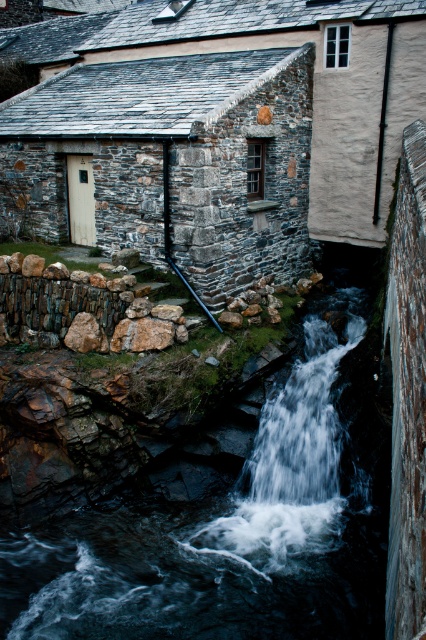
Is rocky stone waterfall at center wider than translucent white water at center?

Incorrect, rocky stone waterfall at center's width does not surpass translucent white water at center's.

Which is in front, point (308, 424) or point (247, 550)?

Point (247, 550)

Does point (305, 550) come farther from viewer compared to point (324, 330)?

That is False.

Image resolution: width=426 pixels, height=640 pixels. In order to click on rocky stone waterfall at center in this screenshot , I will do `click(233, 524)`.